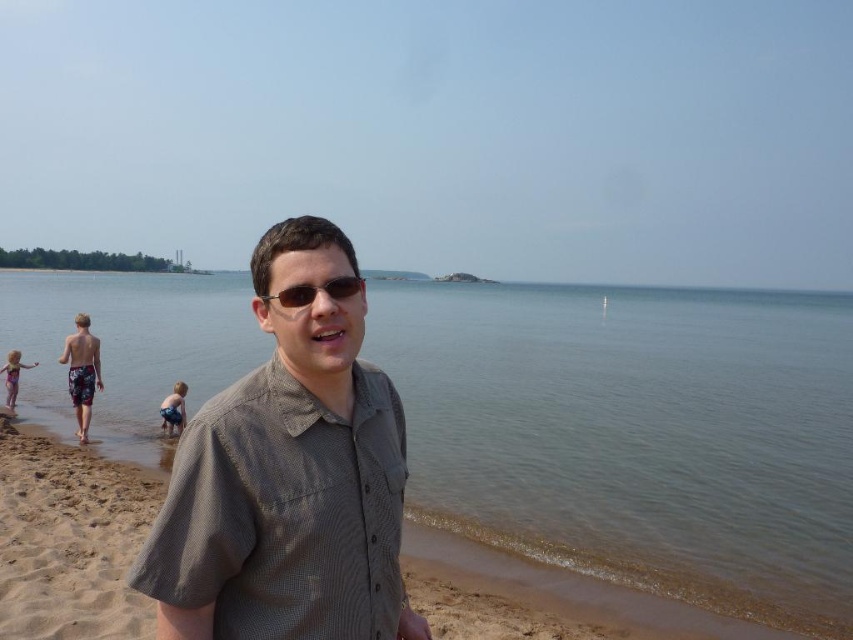
You are a photographer trying to capture the clear water at beach front and the brown textured shirt at center in the same frame. Which object should you focus on first if you want to ensure both are in focus?

The clear water at beach front is larger in size compared to the brown textured shirt at center, so focusing on the larger object first would help ensure both are in focus.

You are a photographer trying to capture a shot of the clear water at beach front and the light pink swimsuit at lower left. Which object appears taller in the photo?

The clear water at beach front appears taller than the light pink swimsuit at lower left in the photo.

You are a photographer standing at the beach and want to take a photo of two points marked in the scene. The first point is at coordinates point (384, 536) and the second is at point (283, 292). Which point is closer to you?

Point (384, 536) is further to the camera than point (283, 292), so the point closer to you is point (283, 292).